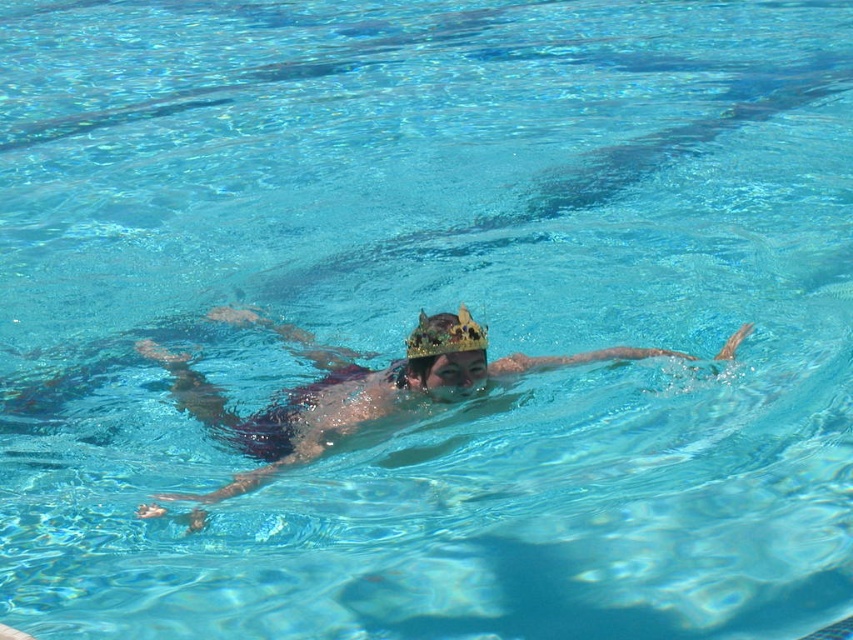
Question: Is the position of metallic gold crown at center less distant than that of gold glittery crown at center?

Choices:
 (A) yes
 (B) no

Answer: (A)

Question: Which object is closer to the camera taking this photo?

Choices:
 (A) metallic gold crown at center
 (B) gold glittery crown at center

Answer: (A)

Question: Considering the relative positions of metallic gold crown at center and gold glittery crown at center in the image provided, where is metallic gold crown at center located with respect to gold glittery crown at center?

Choices:
 (A) right
 (B) left

Answer: (B)

Question: Is metallic gold crown at center further to the viewer compared to gold glittery crown at center?

Choices:
 (A) no
 (B) yes

Answer: (A)